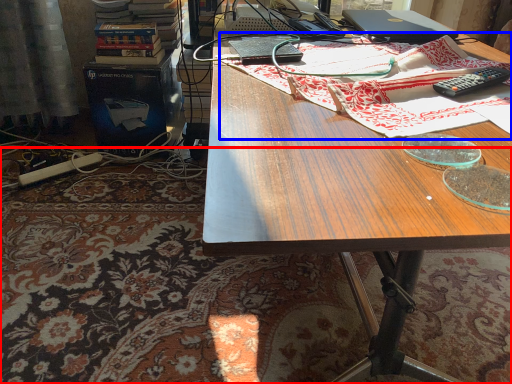
Question: Which object appears farthest to the camera in this image, mat (highlighted by a red box) or cloth (highlighted by a blue box)?

Choices:
 (A) mat
 (B) cloth

Answer: (A)